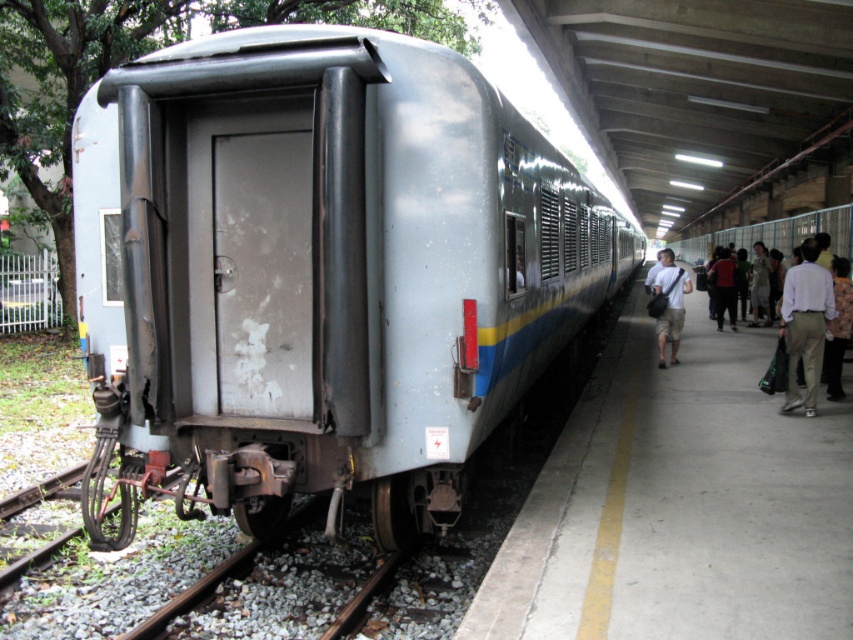
From the picture: Who is higher up, dark gray fabric pants at center-right or light brown fabric shirt at right?

Positioned higher is dark gray fabric pants at center-right.

Can you confirm if dark gray fabric pants at center-right is bigger than light brown fabric shirt at right?

Yes, dark gray fabric pants at center-right is bigger than light brown fabric shirt at right.

What do you see at coordinates (724, 288) in the screenshot? The height and width of the screenshot is (640, 853). I see `dark gray fabric pants at center-right` at bounding box center [724, 288].

Where is `dark gray fabric pants at center-right`? This screenshot has width=853, height=640. dark gray fabric pants at center-right is located at coordinates (724, 288).

The width and height of the screenshot is (853, 640). I want to click on concrete platform at lower center, so click(680, 504).

Does concrete platform at lower center come in front of dark gray fabric pants at center-right?

Yes.

What do you see at coordinates (680, 504) in the screenshot? I see `concrete platform at lower center` at bounding box center [680, 504].

Locate an element on the screen. This screenshot has height=640, width=853. concrete platform at lower center is located at coordinates (680, 504).

This screenshot has height=640, width=853. Describe the element at coordinates (680, 504) in the screenshot. I see `concrete platform at lower center` at that location.

Which is below, concrete platform at lower center or light brown fabric shirt at right?

concrete platform at lower center is below.

Which is behind, point (635, 300) or point (759, 269)?

Point (635, 300)

In order to click on concrete platform at lower center in this screenshot , I will do `click(680, 504)`.